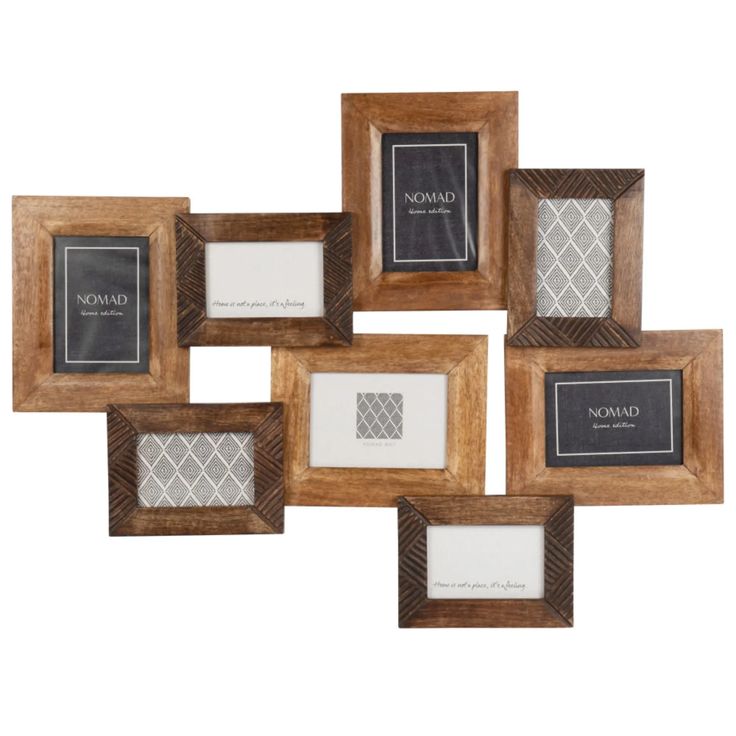
I want to click on wooden picture frames, so click(101, 282), click(268, 280), click(430, 165), click(578, 260), click(601, 392), click(386, 386), click(218, 466), click(500, 564).